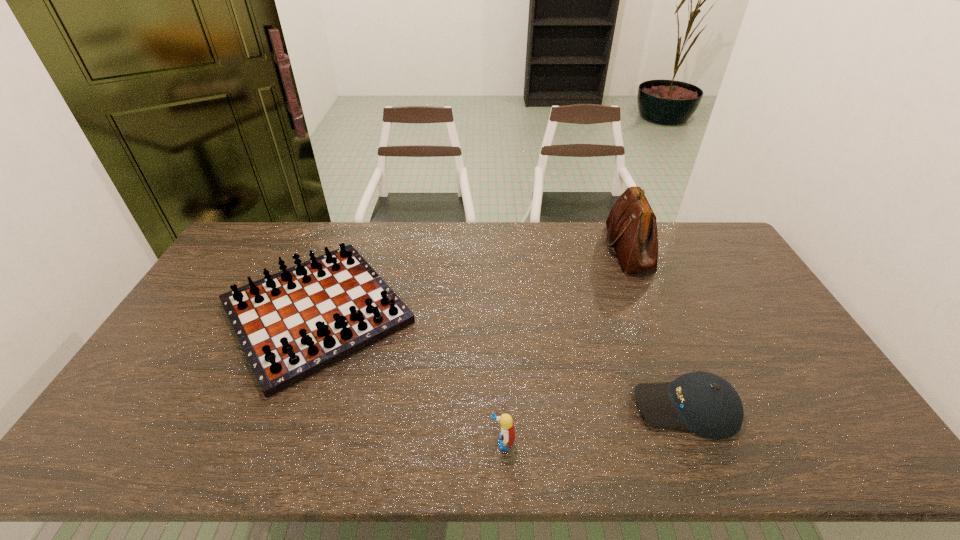
Where is `the tallest object`? The height and width of the screenshot is (540, 960). the tallest object is located at coordinates (631, 224).

Find the location of a particular element. This screenshot has height=540, width=960. chessboard is located at coordinates (292, 324).

This screenshot has width=960, height=540. What are the coordinates of `the third object from right to left` in the screenshot? It's located at (507, 436).

Locate an element on the screen. baseball cap is located at coordinates (706, 404).

Identify the location of vacant space located 0.280m on the right of the tallest object. This screenshot has width=960, height=540. (727, 248).

Find the location of a particular element. Image resolution: width=960 pixels, height=540 pixels. vacant space located on the right of the leftmost object is located at coordinates (536, 312).

Where is `vacant space located on the front-facing side of the Lego`? The image size is (960, 540). vacant space located on the front-facing side of the Lego is located at coordinates (359, 442).

I want to click on vacant space situated on the front-facing side of the Lego, so tap(457, 442).

Find the location of a particular element. This screenshot has height=540, width=960. vacant space located 0.180m on the front-facing side of the Lego is located at coordinates (414, 442).

Identify the location of free spot located on the front-facing side of the shortest object. (578, 407).